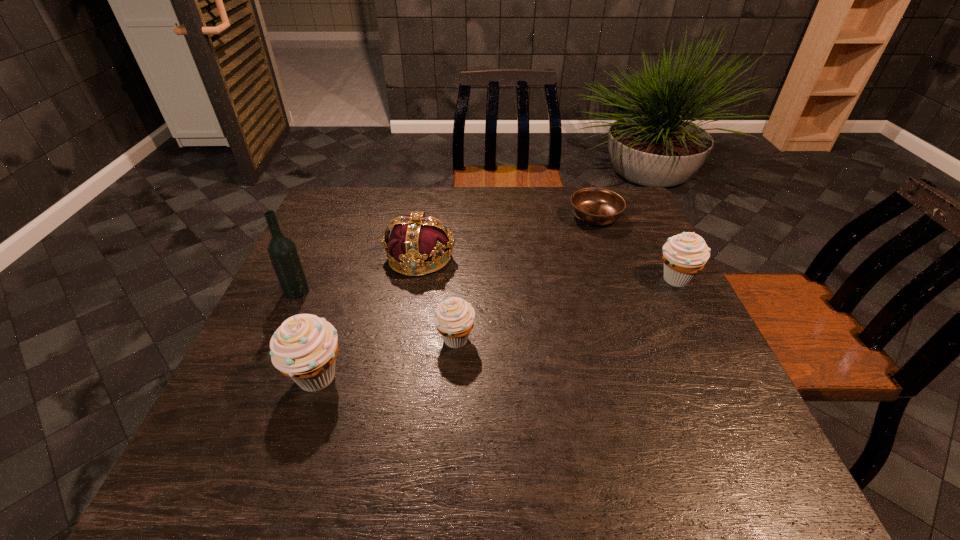
At what (x,y) coordinates should I click in order to perform the action: click on muffin at the right edge. Please return your answer as a coordinate pair (x, y). This screenshot has width=960, height=540. Looking at the image, I should click on (684, 255).

Image resolution: width=960 pixels, height=540 pixels. Find the location of `soup bowl that is at the right edge`. soup bowl that is at the right edge is located at coordinates (596, 206).

You are a GUI agent. You are given a task and a screenshot of the screen. Output one action in this format:
    pyautogui.click(x=<x>, y=<y>)
    Task: Click on the object present at the near left corner
    
    Given the screenshot: What is the action you would take?
    pyautogui.click(x=304, y=348)

Where is `object positioned at the far right corner`? The width and height of the screenshot is (960, 540). object positioned at the far right corner is located at coordinates (596, 206).

Find the location of a particular element. vacant point at the far edge is located at coordinates (458, 218).

I want to click on free space at the left edge of the desktop, so click(341, 234).

This screenshot has width=960, height=540. In the image, there is a desktop. What are the coordinates of `vacant space at the right edge` in the screenshot? It's located at point(648,266).

In the image, there is a desktop. Where is `blank space at the far left corner`? blank space at the far left corner is located at coordinates (350, 217).

Identify the location of vacant space in between the tallest object and the second muffin from right to left. (376, 315).

The image size is (960, 540). What are the coordinates of `vacant area that lies between the crown and the farthest object` in the screenshot? It's located at (508, 237).